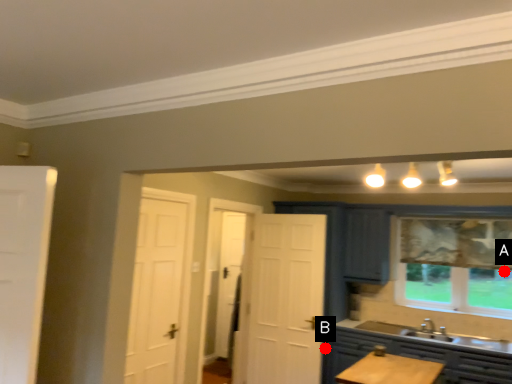
Question: Two points are circled on the image, labeled by A and B beside each circle. Among these points, which one is nearest to the camera?

Choices:
 (A) A is closer
 (B) B is closer

Answer: (B)